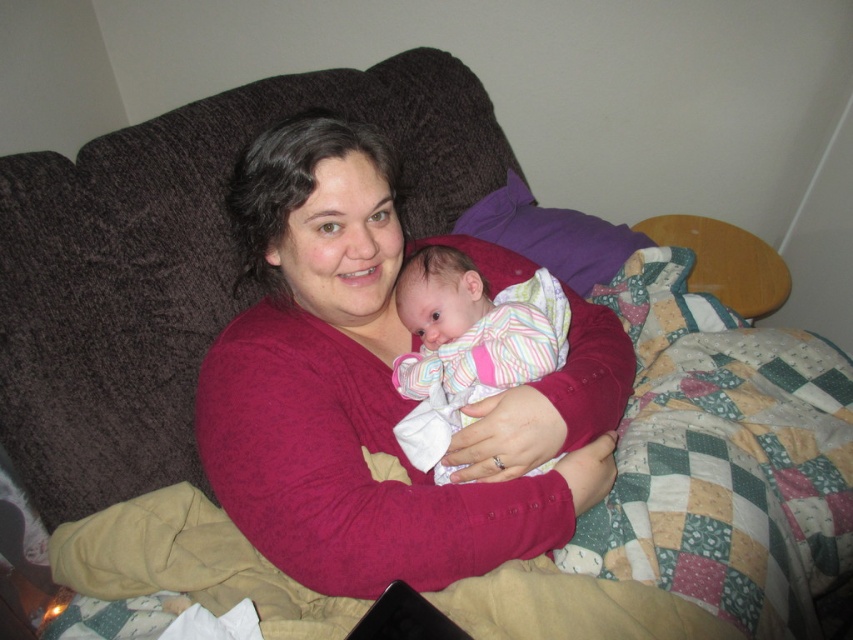
Can you confirm if cotton sweater at center is thinner than striped cotton baby at center?

No, cotton sweater at center is not thinner than striped cotton baby at center.

How far apart are cotton sweater at center and striped cotton baby at center?

cotton sweater at center and striped cotton baby at center are 3.78 inches apart from each other.

Who is more forward, (374, 340) or (471, 262)?

Point (374, 340) is in front.

This screenshot has width=853, height=640. I want to click on cotton sweater at center, so click(x=376, y=390).